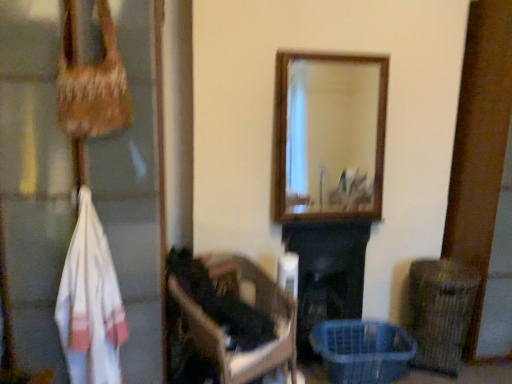
Question: Visually, is white woven bag at left positioned to the left or to the right of white woven towel at left?

Choices:
 (A) right
 (B) left

Answer: (B)

Question: From a real-world perspective, is white woven bag at left physically located above or below white woven towel at left?

Choices:
 (A) below
 (B) above

Answer: (B)

Question: Considering the real-world distances, which object is closest to the black matte fireplace at center?

Choices:
 (A) dark brown wooden chair at center
 (B) white woven bag at left
 (C) brown wicker basket at lower right
 (D) translucent plastic basket at lower right
 (E) white woven towel at left

Answer: (D)

Question: Which object is the closest to the brown wicker basket at lower right?

Choices:
 (A) translucent plastic basket at lower right
 (B) white woven bag at left
 (C) white woven towel at left
 (D) black matte fireplace at center
 (E) dark brown wooden chair at center

Answer: (A)